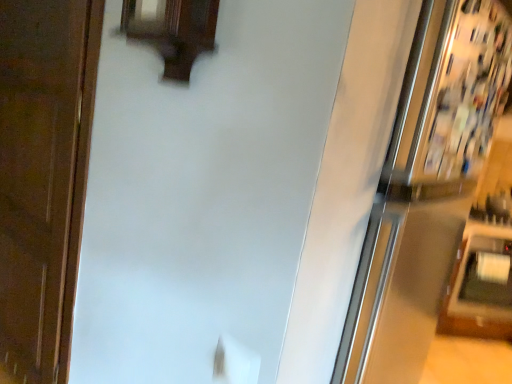
The width and height of the screenshot is (512, 384). What do you see at coordinates (426, 187) in the screenshot?
I see `white glossy fridge at upper right` at bounding box center [426, 187].

Locate an element on the screen. white glossy fridge at upper right is located at coordinates 426,187.

What is the approximate width of white glossy fridge at upper right?

white glossy fridge at upper right is 46.26 centimeters wide.

Describe the element at coordinates (42, 177) in the screenshot. I see `brown wood door at left` at that location.

You are a GUI agent. You are given a task and a screenshot of the screen. Output one action in this format:
    pyautogui.click(x=<x>, y=<y>)
    Task: Click on the brown wood door at left
    This screenshot has height=384, width=512.
    Given the screenshot: What is the action you would take?
    pyautogui.click(x=42, y=177)

I want to click on white glossy fridge at upper right, so pos(426,187).

Is brown wood door at left at the right side of white glossy fridge at upper right?

In fact, brown wood door at left is to the left of white glossy fridge at upper right.

Is brown wood door at left in front of or behind white glossy fridge at upper right in the image?

Clearly, brown wood door at left is behind white glossy fridge at upper right.

Does point (26, 55) appear closer or farther from the camera than point (367, 292)?

Clearly, point (26, 55) is more distant from the camera than point (367, 292).

From the image's perspective, does brown wood door at left appear higher than white glossy fridge at upper right?

Yes, from the image's perspective, brown wood door at left is over white glossy fridge at upper right.

From a real-world perspective, which is physically below, brown wood door at left or white glossy fridge at upper right?

brown wood door at left.

Looking at their sizes, would you say brown wood door at left is wider or thinner than white glossy fridge at upper right?

Clearly, brown wood door at left has less width compared to white glossy fridge at upper right.

Considering the sizes of brown wood door at left and white glossy fridge at upper right in the image, is brown wood door at left taller or shorter than white glossy fridge at upper right?

Clearly, brown wood door at left is shorter compared to white glossy fridge at upper right.

Considering the sizes of brown wood door at left and white glossy fridge at upper right in the image, is brown wood door at left bigger or smaller than white glossy fridge at upper right?

In the image, brown wood door at left appears to be smaller than white glossy fridge at upper right.

Is brown wood door at left not inside white glossy fridge at upper right?

Indeed, brown wood door at left is completely outside white glossy fridge at upper right.

Is brown wood door at left next to white glossy fridge at upper right?

No.

Is brown wood door at left aimed at white glossy fridge at upper right?

No, brown wood door at left is not turned towards white glossy fridge at upper right.

Can you tell me how much brown wood door at left and white glossy fridge at upper right differ in facing direction?

The facing directions of brown wood door at left and white glossy fridge at upper right are 90.6 degrees apart.

How far apart are brown wood door at left and white glossy fridge at upper right?

brown wood door at left is 1.88 meters from white glossy fridge at upper right.

The image size is (512, 384). I want to click on door below the white glossy fridge at upper right (from a real-world perspective), so click(x=42, y=177).

Does white glossy fridge at upper right appear on the left side of brown wood door at left?

No, white glossy fridge at upper right is not to the left of brown wood door at left.

From the picture: In the image, is white glossy fridge at upper right positioned in front of or behind brown wood door at left?

Visually, white glossy fridge at upper right is located in front of brown wood door at left.

Considering the points (428, 60) and (8, 97), which point is behind, point (428, 60) or point (8, 97)?

The point (8, 97) is behind.

From the image's perspective, is white glossy fridge at upper right beneath brown wood door at left?

Yes, from the image's perspective, white glossy fridge at upper right is below brown wood door at left.

From a real-world perspective, is white glossy fridge at upper right physically above brown wood door at left?

Yes, from a real-world perspective, white glossy fridge at upper right is over brown wood door at left

Which of these two, white glossy fridge at upper right or brown wood door at left, is thinner?

brown wood door at left.

Between white glossy fridge at upper right and brown wood door at left, which one has more height?

With more height is white glossy fridge at upper right.

Who is smaller, white glossy fridge at upper right or brown wood door at left?

brown wood door at left.

Is white glossy fridge at upper right located outside brown wood door at left?

Yes, white glossy fridge at upper right is not within brown wood door at left.

Are white glossy fridge at upper right and brown wood door at left located far from each other?

Indeed, white glossy fridge at upper right is not near brown wood door at left.

Is brown wood door at left at the back of white glossy fridge at upper right?

No.

Can you tell me how much white glossy fridge at upper right and brown wood door at left differ in facing direction?

90.6 degrees separate the facing orientations of white glossy fridge at upper right and brown wood door at left.

The height and width of the screenshot is (384, 512). I want to click on fridge to the right of brown wood door at left, so click(426, 187).

Identify the location of door located above the white glossy fridge at upper right (from the image's perspective). (42, 177).

The width and height of the screenshot is (512, 384). I want to click on door on the left of white glossy fridge at upper right, so click(x=42, y=177).